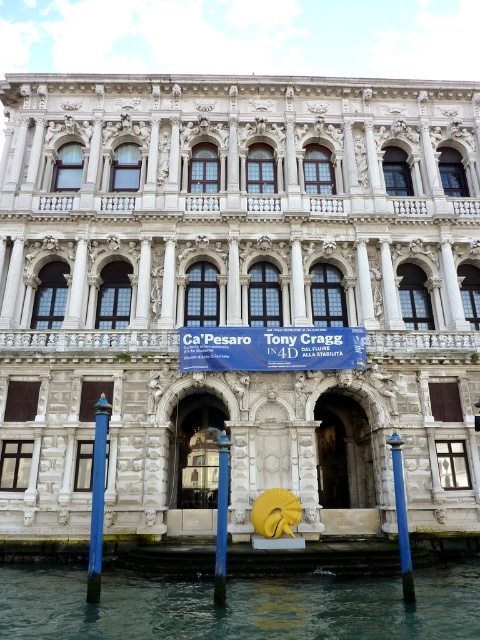
Between point (393, 577) and point (253, 358), which one is positioned behind?

Positioned behind is point (253, 358).

Does point (300, 576) come in front of point (350, 348)?

Yes.

You are a GUI agent. You are given a task and a screenshot of the screen. Output one action in this format:
    pyautogui.click(x=<x>, y=<y>)
    Task: Click on the clear water at lower center
    This screenshot has width=480, height=640.
    Given the screenshot: What is the action you would take?
    pyautogui.click(x=239, y=605)

What do you see at coordinates (271, 348) in the screenshot? I see `blue fabric sign at center` at bounding box center [271, 348].

Is blue fabric sign at center bigger than blue glossy pole at center?

Incorrect, blue fabric sign at center is not larger than blue glossy pole at center.

Find the location of a particular element. blue fabric sign at center is located at coordinates pyautogui.click(x=271, y=348).

Based on the photo, can you confirm if blue fabric sign at center is bigger than blue painted metal pole at lower right?

No.

Between point (204, 337) and point (391, 449), which one is positioned behind?

The point (204, 337) is behind.

The width and height of the screenshot is (480, 640). Find the location of `blue fabric sign at center`. blue fabric sign at center is located at coordinates (271, 348).